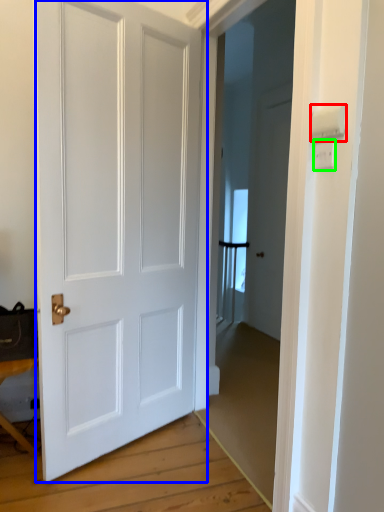
Question: Based on their relative distances, which object is farther from light switch (highlighted by a red box)? Choose from door (highlighted by a blue box) and light switch (highlighted by a green box).

Choices:
 (A) door
 (B) light switch

Answer: (A)